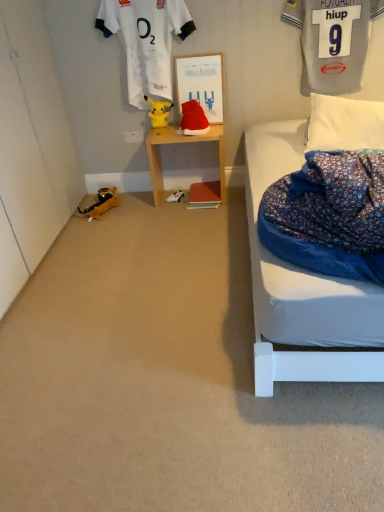
Locate an element on the screen. vacant space situated above matte cardboard bulletin board at center (from a real-world perspective) is located at coordinates (206, 48).